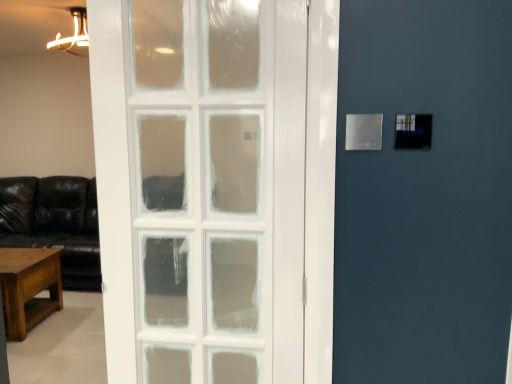
Question: Does rustic wood table at lower left have a smaller size compared to transparent plastic light switch at upper right?

Choices:
 (A) yes
 (B) no

Answer: (B)

Question: From the image's perspective, is rustic wood table at lower left beneath transparent plastic light switch at upper right?

Choices:
 (A) yes
 (B) no

Answer: (A)

Question: Is rustic wood table at lower left positioned in front of transparent plastic light switch at upper right?

Choices:
 (A) no
 (B) yes

Answer: (A)

Question: Is rustic wood table at lower left completely or partially outside of transparent plastic light switch at upper right?

Choices:
 (A) no
 (B) yes

Answer: (B)

Question: Is transparent plastic light switch at upper right located within rustic wood table at lower left?

Choices:
 (A) no
 (B) yes

Answer: (A)

Question: Is rustic wood table at lower left oriented away from transparent plastic light switch at upper right?

Choices:
 (A) no
 (B) yes

Answer: (A)

Question: From a real-world perspective, is transparent plastic light switch at upper right over rustic wood table at lower left?

Choices:
 (A) yes
 (B) no

Answer: (A)

Question: Can you confirm if transparent plastic light switch at upper right is bigger than rustic wood table at lower left?

Choices:
 (A) yes
 (B) no

Answer: (B)

Question: Is rustic wood table at lower left surrounded by transparent plastic light switch at upper right?

Choices:
 (A) no
 (B) yes

Answer: (A)

Question: From the image's perspective, is transparent plastic light switch at upper right located beneath rustic wood table at lower left?

Choices:
 (A) no
 (B) yes

Answer: (A)

Question: Can you confirm if transparent plastic light switch at upper right is shorter than rustic wood table at lower left?

Choices:
 (A) yes
 (B) no

Answer: (A)

Question: Considering the relative sizes of transparent plastic light switch at upper right and rustic wood table at lower left in the image provided, is transparent plastic light switch at upper right thinner than rustic wood table at lower left?

Choices:
 (A) no
 (B) yes

Answer: (B)

Question: Based on their positions, is transparent plastic light switch at upper right located to the left or right of rustic wood table at lower left?

Choices:
 (A) left
 (B) right

Answer: (B)